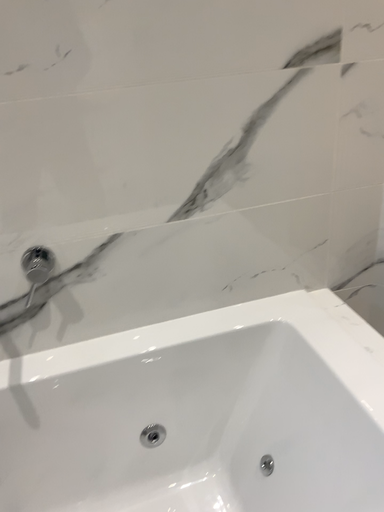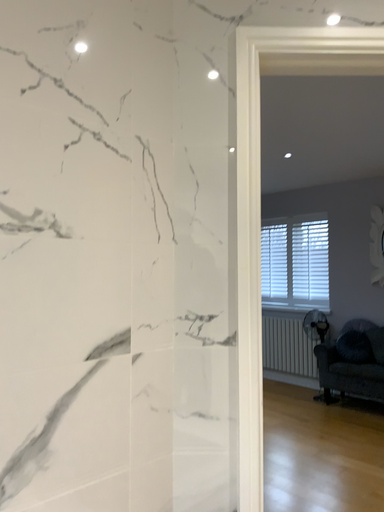
Question: How did the camera likely rotate when shooting the video?

Choices:
 (A) rotated left
 (B) rotated right

Answer: (B)